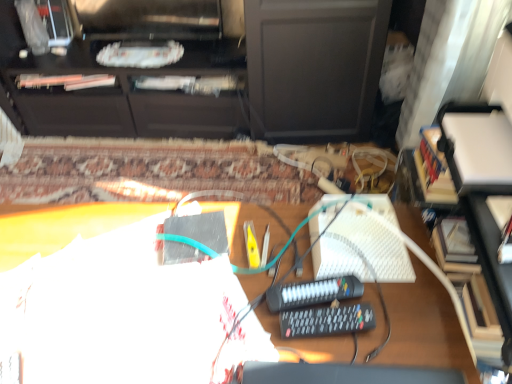
Where is `free spot above white matte desk at center (from a real-world perspective)`? This screenshot has height=384, width=512. free spot above white matte desk at center (from a real-world perspective) is located at coordinates (177, 279).